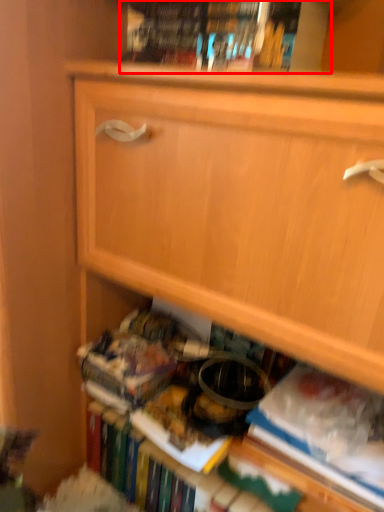
Question: From the image's perspective, considering the relative positions of book (annotated by the red box) and paperback book in the image provided, where is book (annotated by the red box) located with respect to the staircase?

Choices:
 (A) above
 (B) below

Answer: (A)